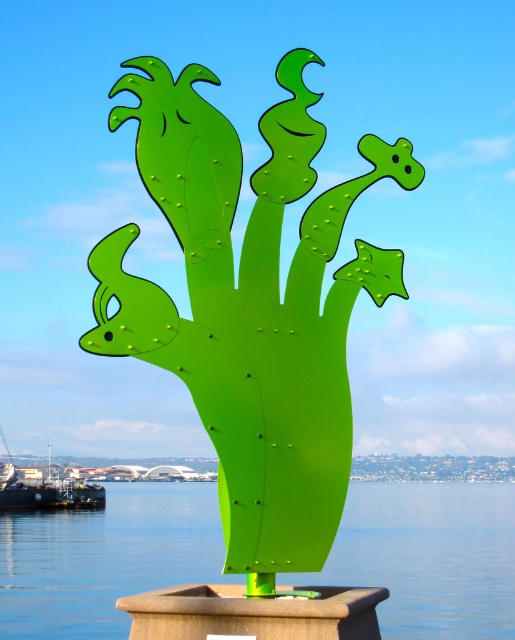
Who is positioned more to the left, green metallic sculpture at center or green plastic water at center?

From the viewer's perspective, green metallic sculpture at center appears more on the left side.

Describe the element at coordinates (250, 307) in the screenshot. I see `green metallic sculpture at center` at that location.

Find the location of a particular element. This screenshot has width=515, height=640. green metallic sculpture at center is located at coordinates (250, 307).